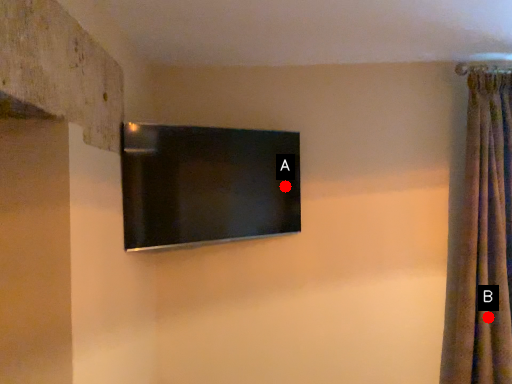
Question: Two points are circled on the image, labeled by A and B beside each circle. Which of the following is the closest to the observer?

Choices:
 (A) A is closer
 (B) B is closer

Answer: (B)